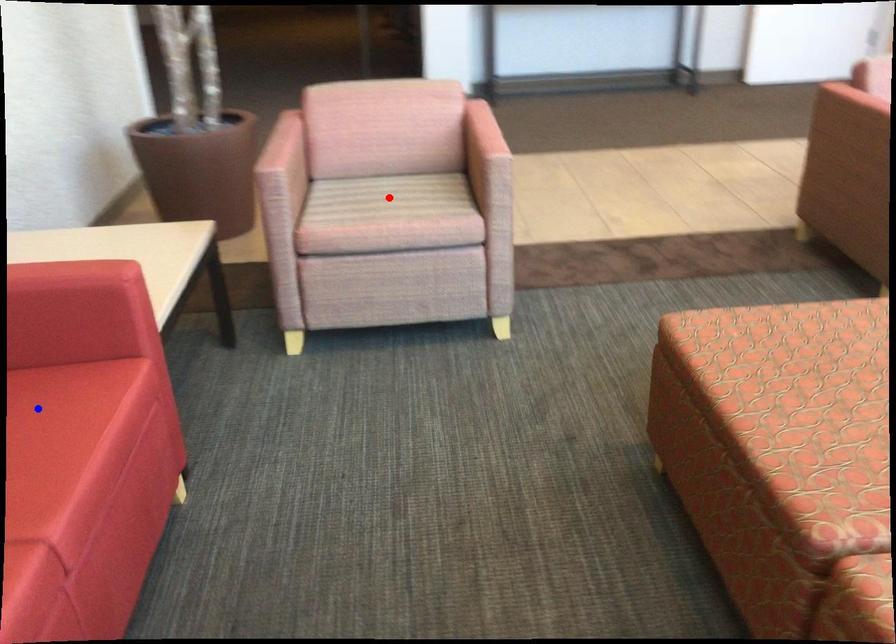
Question: Which of the two points in the image is closer to the camera?

Choices:
 (A) Blue point is closer.
 (B) Red point is closer.

Answer: (A)